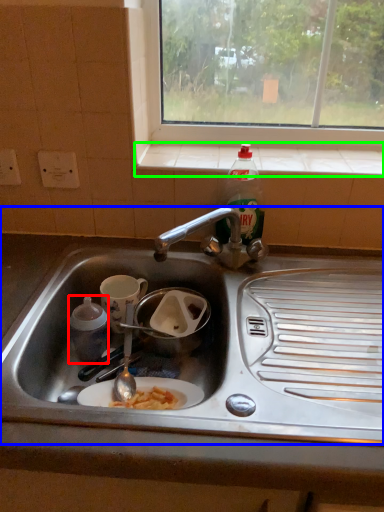
Question: Which object is positioned closest to coffee cup (highlighted by a red box)? Select from sink (highlighted by a blue box) and window sill (highlighted by a green box).

Choices:
 (A) sink
 (B) window sill

Answer: (A)